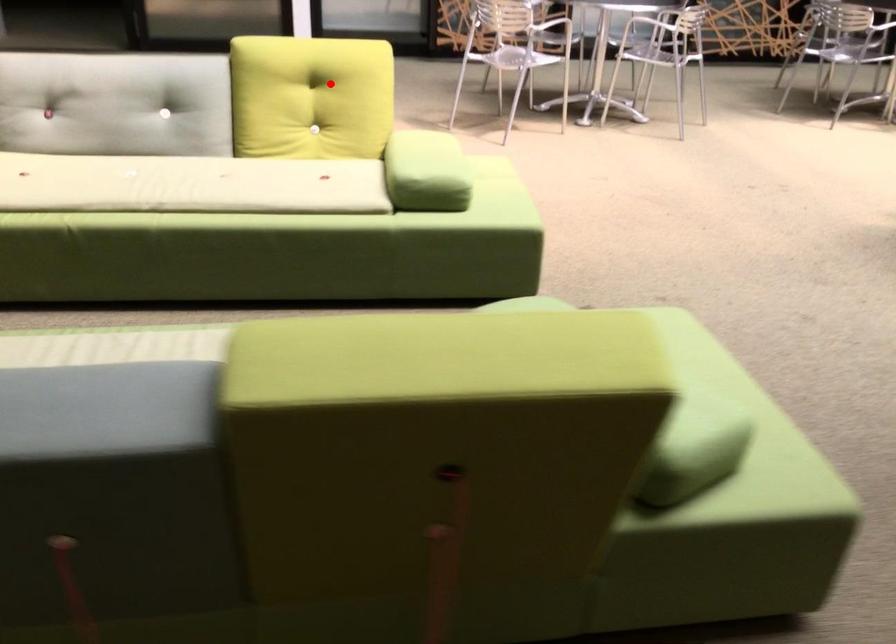
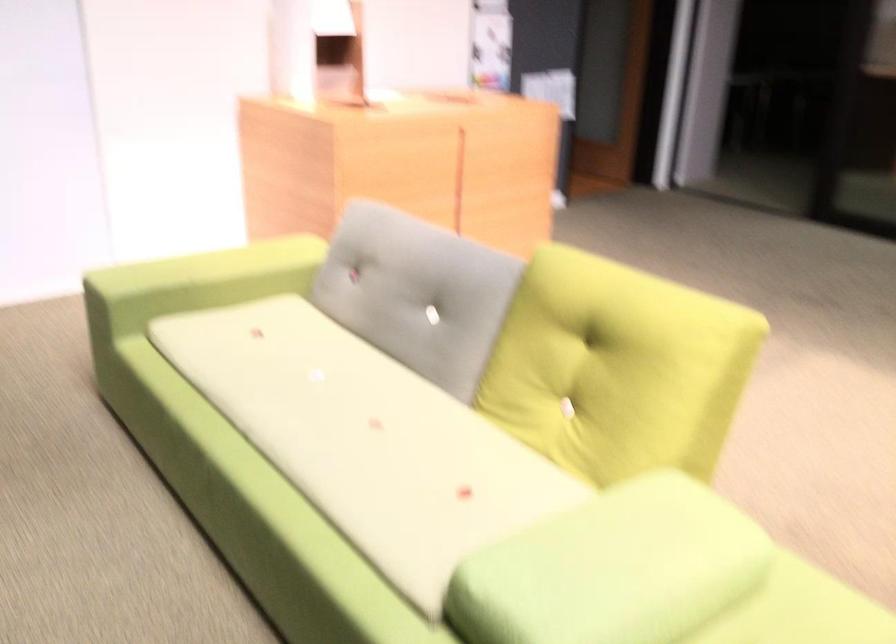
Question: I am providing you with two images of the same scene from different viewpoints. Given a red point in image1, look at the same physical point in image2. Is it:

Choices:
 (A) Closer to the viewpoint
 (B) Farther from the viewpoint

Answer: (A)